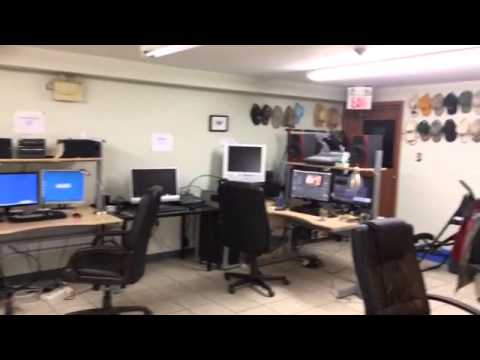
At what (x,y) coordinates should I click in order to perform the action: click on overhead lights. Please return your answer as a coordinate pair (x, y). This screenshot has width=480, height=360. Looking at the image, I should click on (164, 56), (387, 54), (434, 61).